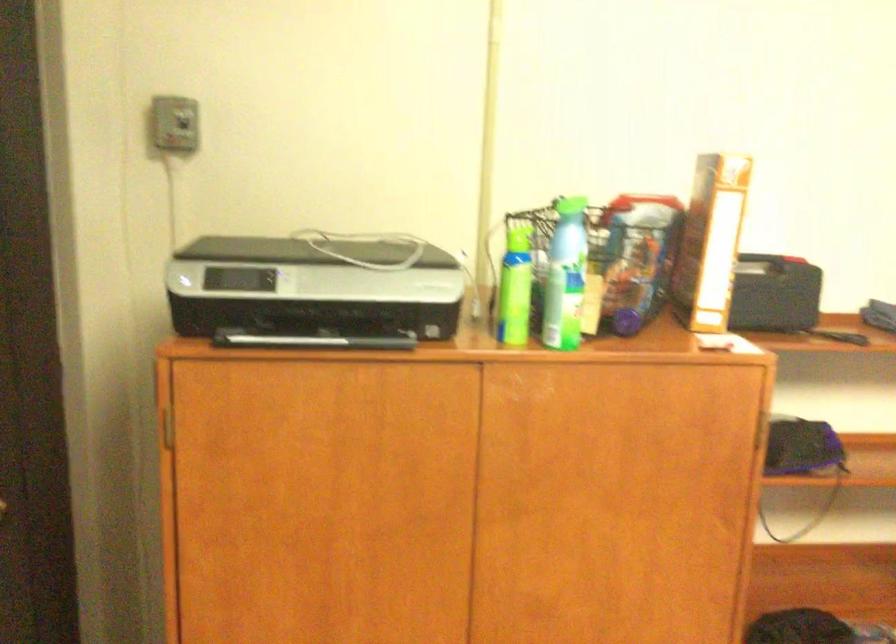
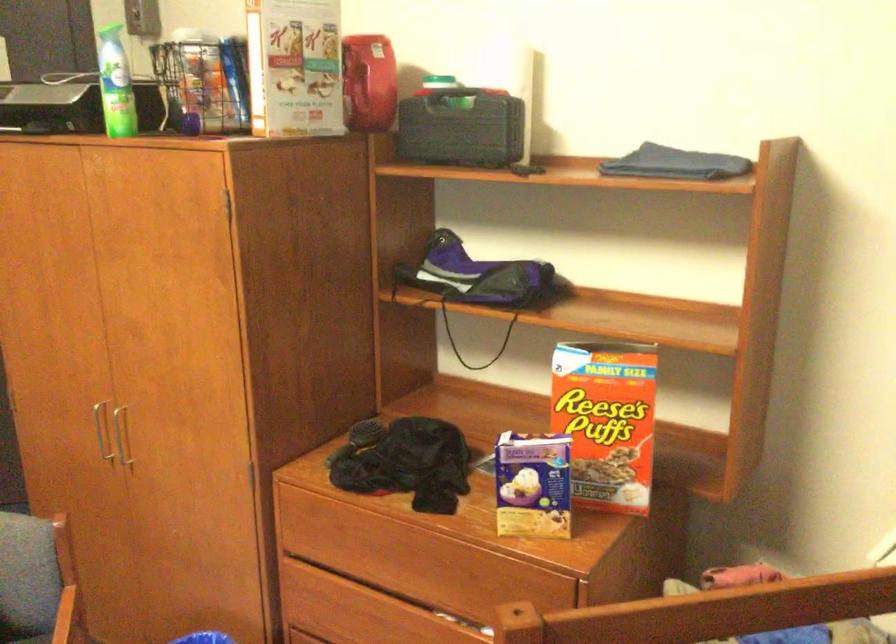
The point at (709, 237) is marked in the first image. Where is the corresponding point in the second image?

(368, 82)